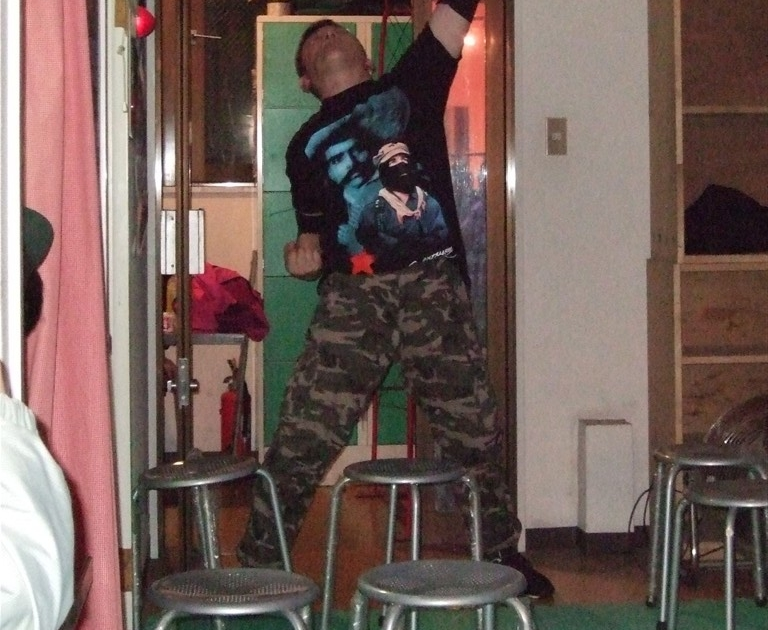
Where is `stool`? The image size is (768, 630). stool is located at coordinates (209, 476), (237, 588), (405, 474), (447, 573), (689, 453), (739, 501).